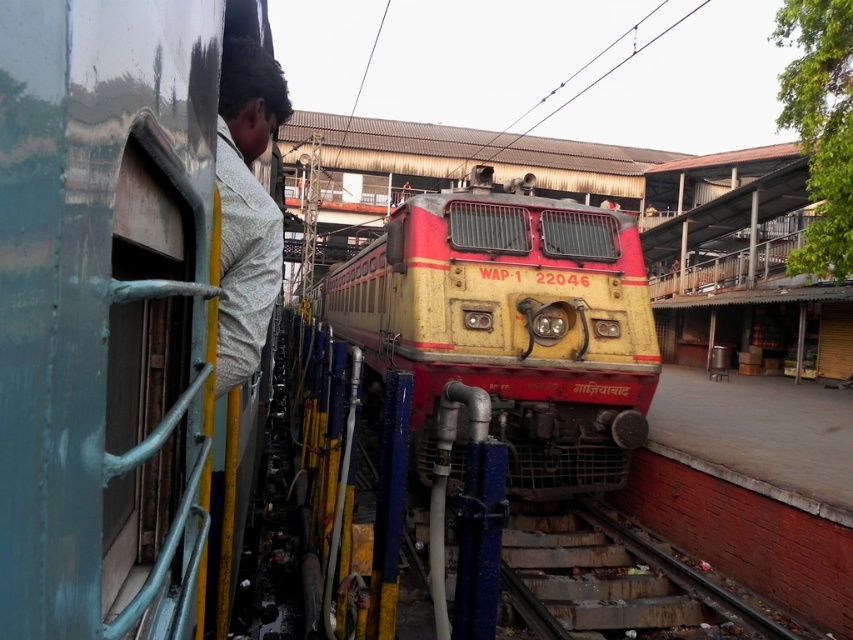
You are standing at the point marked by coordinates point (x=511, y=324). What object are you directly facing?

You are directly facing the yellow matte train at center.

You are a railway inspector checking the alignment of the train tracks. You notice the yellow matte train at center and the rusty metal train track at lower center. Based on their widths, which one is wider?

The yellow matte train at center is wider than the rusty metal train track at lower center according to the description.

You are standing on the platform at the railway station and want to take a photo of the yellow matte train at center from a safe distance. The recommended safe distance for photographing trains is at least 5 meters. Can you safely take the photo from where you are?

The yellow matte train at center and the viewer are 6.04 meters apart, which is more than the recommended 5 meters safe distance. Yes, you can safely take the photo from your current position.